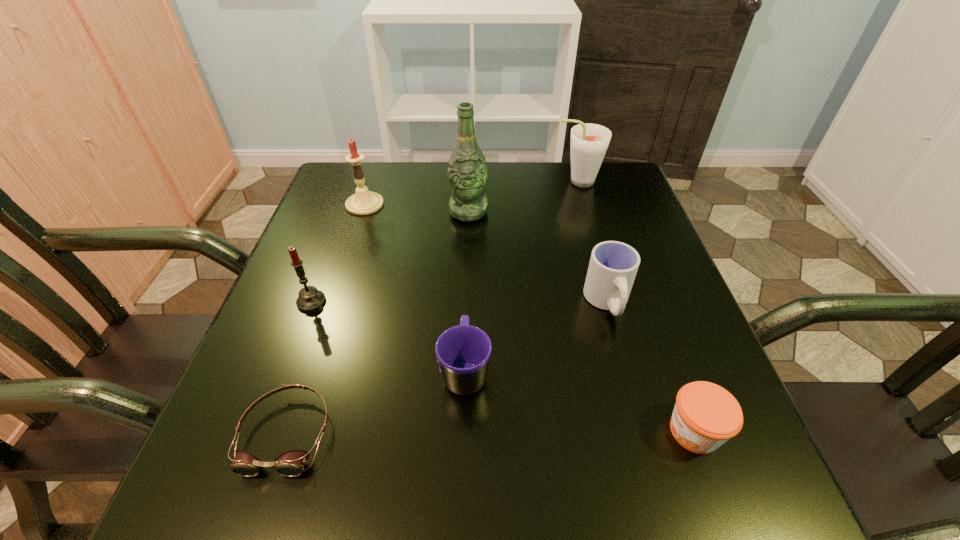
In order to click on free spot between the jam and the sixth tallest object in this screenshot , I will do pyautogui.click(x=580, y=401).

Image resolution: width=960 pixels, height=540 pixels. I want to click on vacant area that lies between the beer bottle and the sixth tallest object, so click(467, 291).

Image resolution: width=960 pixels, height=540 pixels. Identify the location of free space that is in between the jam and the fifth shortest object. (503, 367).

Image resolution: width=960 pixels, height=540 pixels. Identify the location of object that is the closest to the shorter candle. (291, 463).

Identify the location of object that stands as the fourth closest to the shortest object. (467, 174).

This screenshot has width=960, height=540. I want to click on free spot that satisfies the following two spatial constraints: 1. on the back side of the shorter candle; 2. on the right side of the taller candle, so click(348, 205).

Locate an element on the screen. The width and height of the screenshot is (960, 540). free location that satisfies the following two spatial constraints: 1. on the drink side of the farthest object; 2. with the handle on the side of the cup is located at coordinates (612, 302).